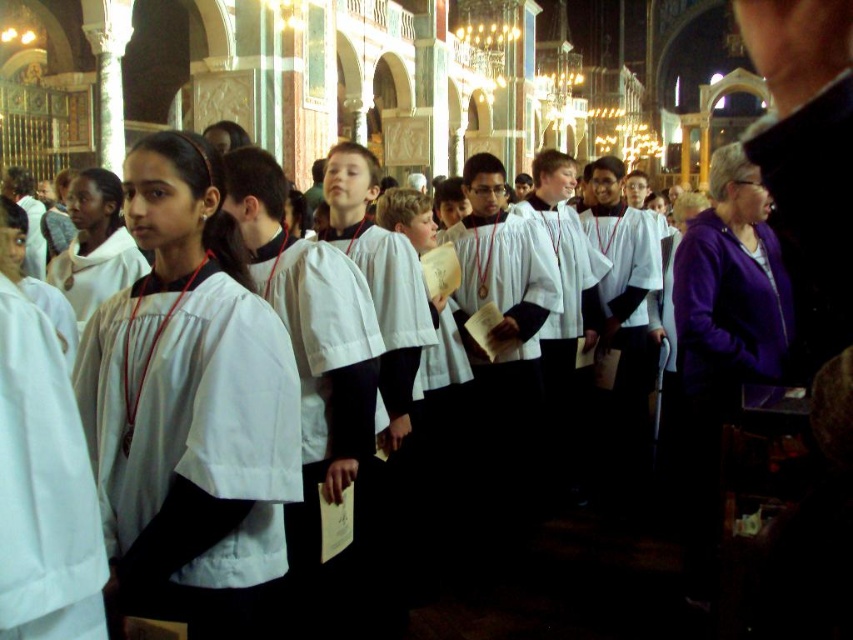
Question: Is white matte/soft robe at center wider than white matte robe at left?

Choices:
 (A) no
 (B) yes

Answer: (B)

Question: Which point is closer to the camera taking this photo?

Choices:
 (A) (7, 304)
 (B) (221, 326)

Answer: (A)

Question: Does white matte/soft robe at center have a greater width compared to white matte robe at left?

Choices:
 (A) no
 (B) yes

Answer: (B)

Question: Observing the image, what is the correct spatial positioning of white matte/soft robe at center in reference to white matte robe at left?

Choices:
 (A) right
 (B) left

Answer: (A)

Question: Among these objects, which one is farthest from the camera?

Choices:
 (A) white matte robe at left
 (B) white matte/soft robe at center

Answer: (B)